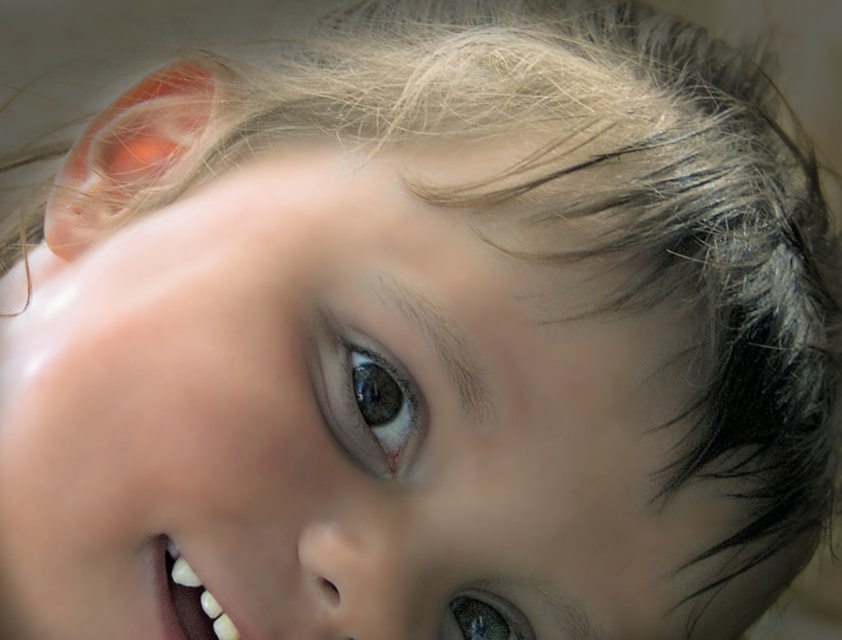
You are a photographer trying to capture the child in the image. You need to adjust your camera settings to focus on both the brown glossy eye at center and the shiny brown eye at lower center. Which eye should you focus on first to ensure both are in focus?

The brown glossy eye at center is larger in size than the shiny brown eye at lower center, so focusing on the larger eye first will help ensure both are in focus as it occupies more visual space.

You are a dentist examining a child. You need to check the shiny brown eye at lower center and the white glossy teeth at lower left. Can you reach both areas within 3 inches using a small mirror that has a 2.5 inch diameter?

The distance between the shiny brown eye at lower center and the white glossy teeth at lower left is 2.89 inches. Since the mirror has a 2.5 inch diameter, which is smaller than the distance, you may need to adjust the mirror or move closer to examine both areas properly.

You are a photographer adjusting the focus of your camera. You want to ensure both the brown glossy eye at center and the white glossy teeth at lower left are clearly visible. Given their sizes, which object should you adjust the focus on first to capture both effectively?

The brown glossy eye at center has a greater height compared to the white glossy teeth at lower left, so you should focus on the brown glossy eye at center first since it is larger and requires more detailed focus.